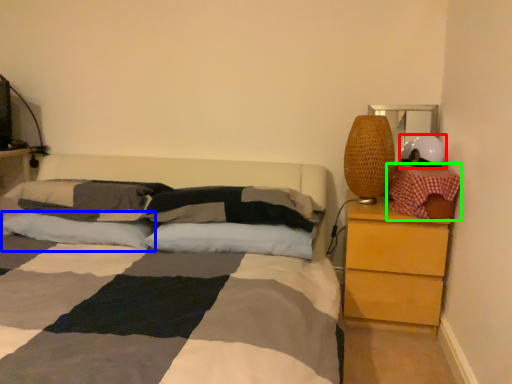
Question: Based on their relative distances, which object is nearer to helmet (highlighted by a red box)? Choose from pillow (highlighted by a blue box) and pillow (highlighted by a green box).

Choices:
 (A) pillow
 (B) pillow

Answer: (B)